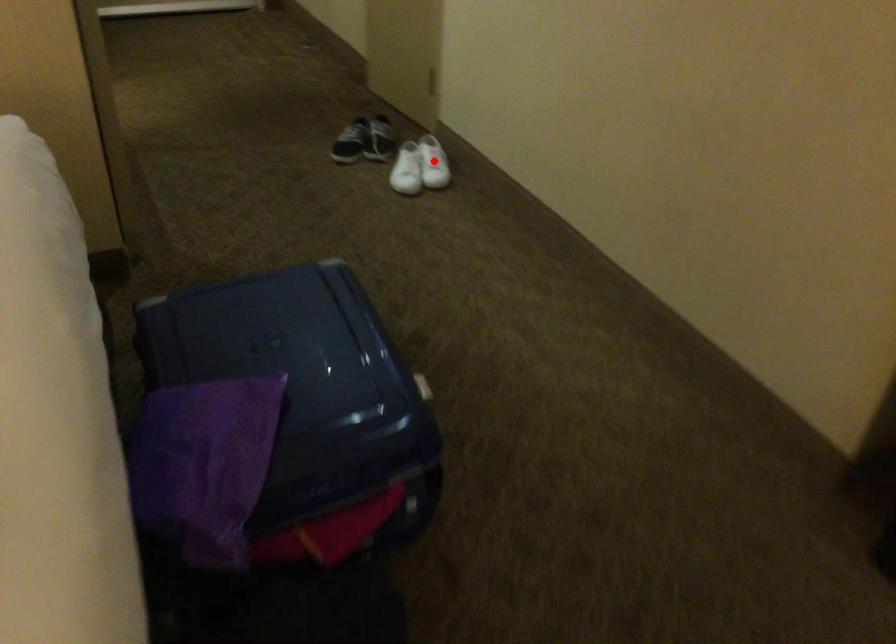
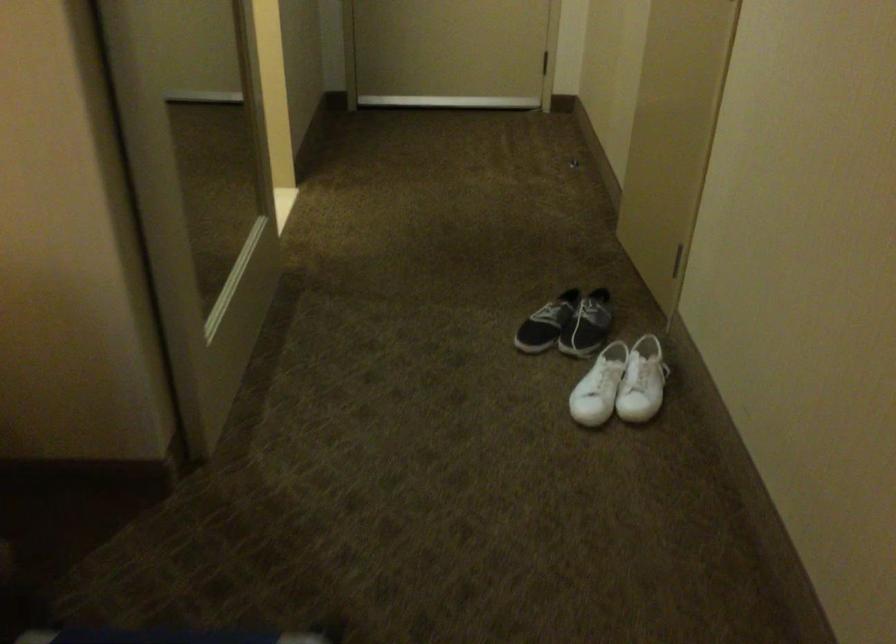
In the second image, find the point that corresponds to the highlighted location in the first image.

(642, 382)